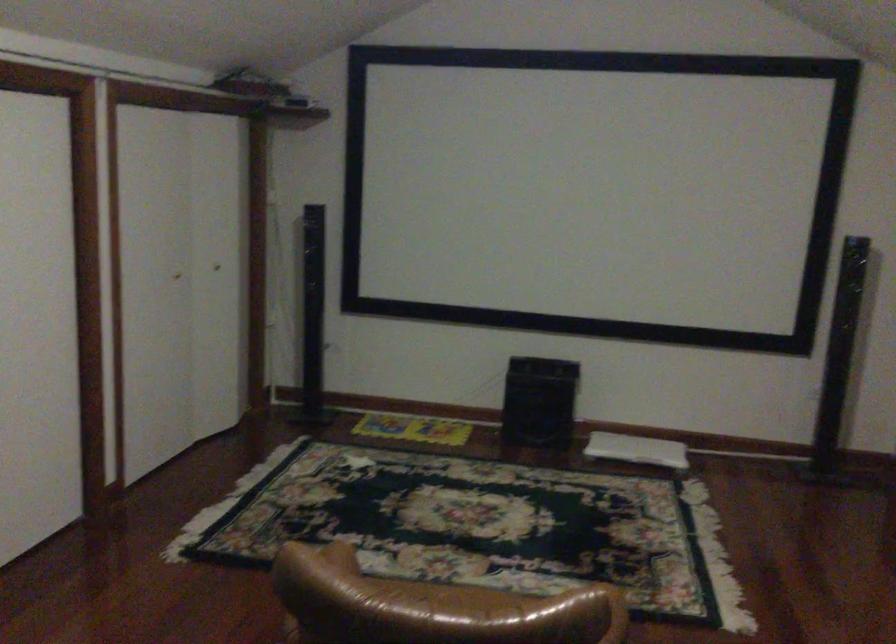
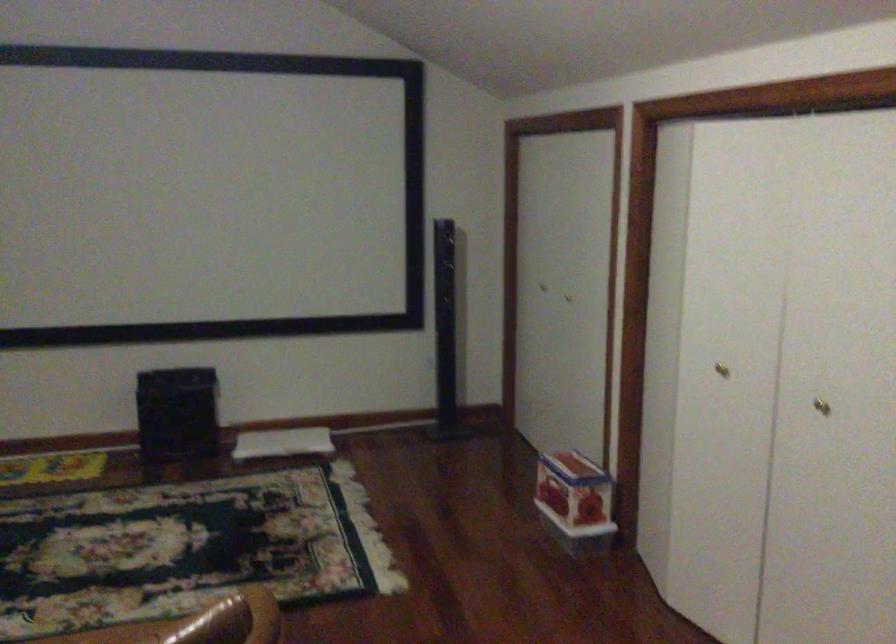
Question: The camera is either moving clockwise (left) or counter-clockwise (right) around the object. The first image is from the beginning of the video and the second image is from the end. Is the camera moving left or right when shooting the video?

Choices:
 (A) Left
 (B) Right

Answer: (A)